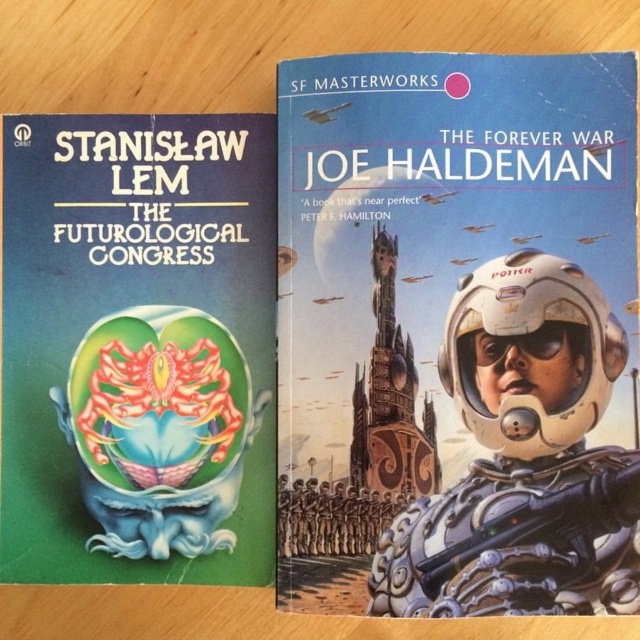
Question: Can you confirm if metallic silver spacesuit at center is positioned to the right of green matte brain at center?

Choices:
 (A) no
 (B) yes

Answer: (B)

Question: Which of the following is the closest to the observer?

Choices:
 (A) (147, 182)
 (B) (579, 483)
 (C) (529, 529)

Answer: (C)

Question: Which of the following is the farthest from the observer?

Choices:
 (A) white metallic astronaut at center
 (B) green matte brain at center

Answer: (B)

Question: Can you confirm if green matte brain at center is wider than white metallic astronaut at center?

Choices:
 (A) yes
 (B) no

Answer: (A)

Question: Is green matte brain at center behind white metallic astronaut at center?

Choices:
 (A) yes
 (B) no

Answer: (A)

Question: Which of the following is the farthest from the observer?

Choices:
 (A) (208, 364)
 (B) (488, 340)

Answer: (A)